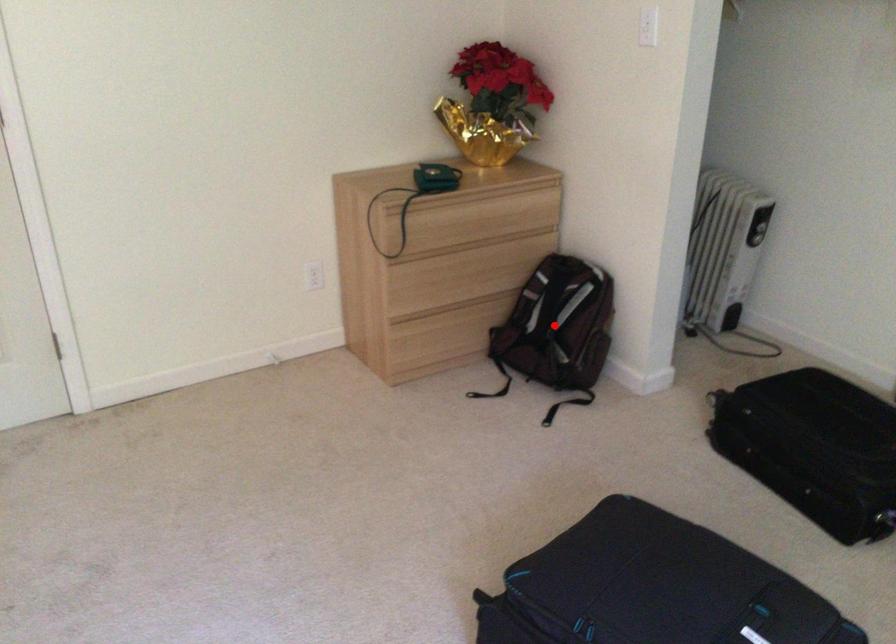
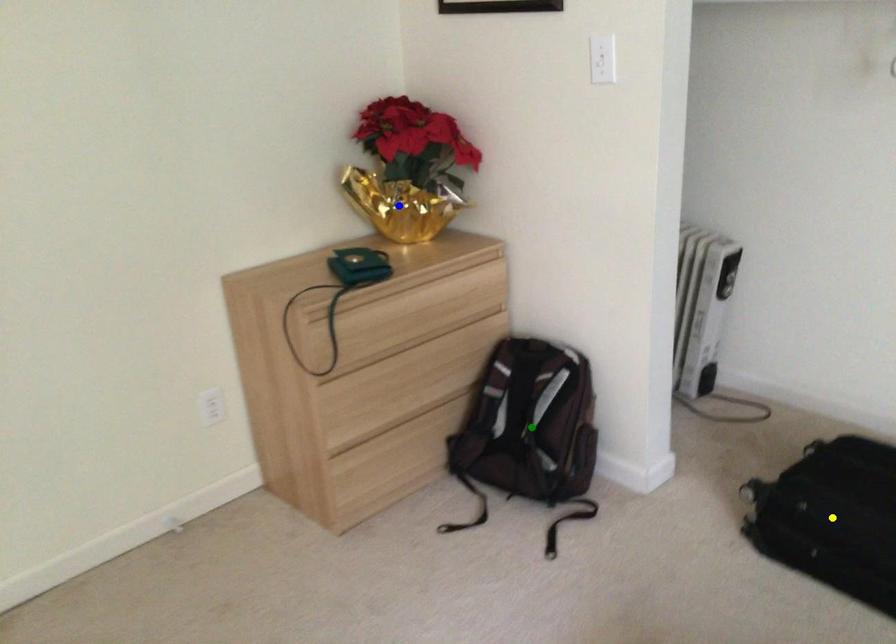
Question: I am providing you with two images of the same scene from different viewpoints. A red point is marked on the first image. You are given multiple points on the second image. Which spot in image 2 lines up with the point in image 1?

Choices:
 (A) yellow point
 (B) green point
 (C) blue point

Answer: (B)